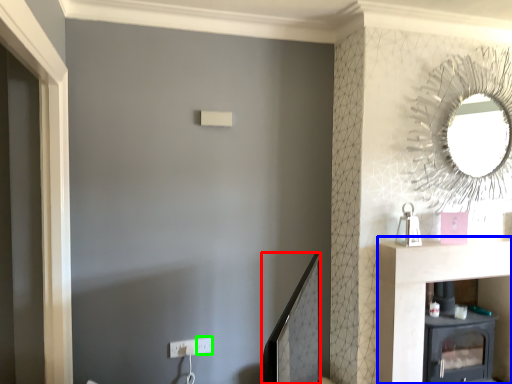
Question: Considering the real-world distances, which object is farthest from mirror (highlighted by a red box)? vanity (highlighted by a blue box) or electric outlet (highlighted by a green box)?

Choices:
 (A) vanity
 (B) electric outlet

Answer: (A)